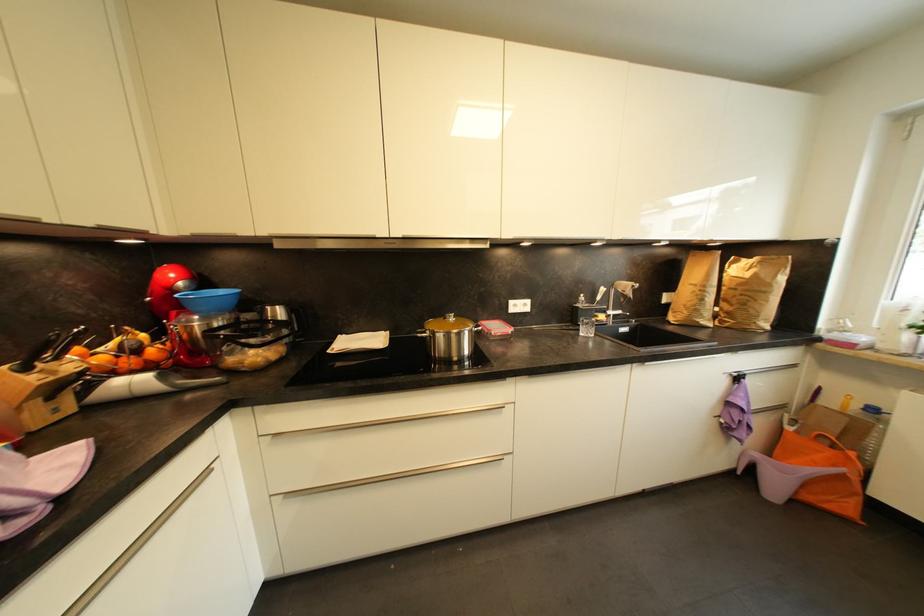
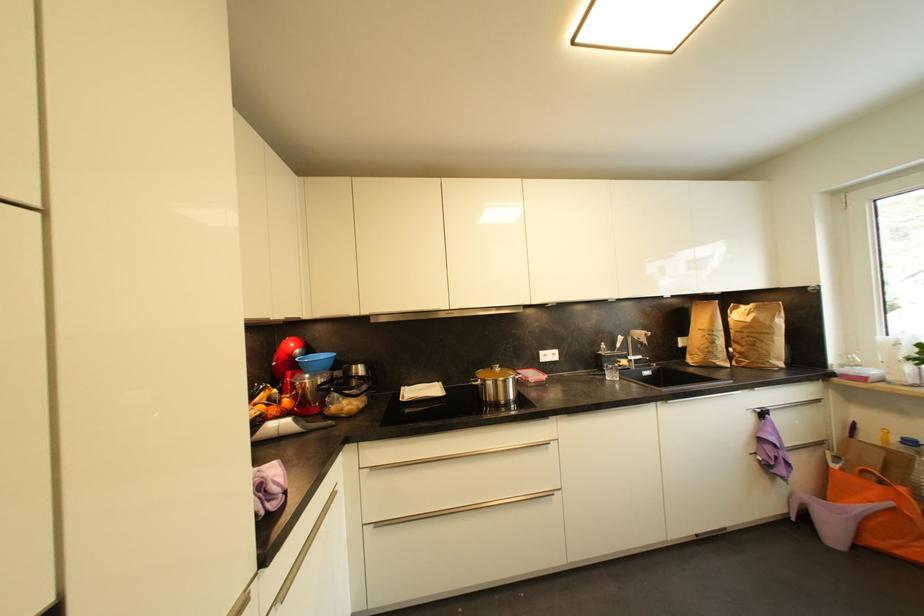
Find the pixel in the second image that matches [760,456] in the first image.

(811, 498)